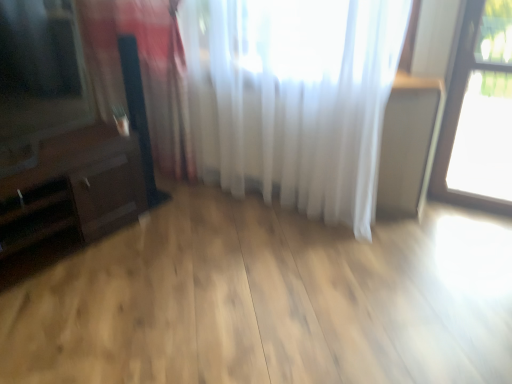
Question: Considering the relative sizes of dark brown wood dresser at left and white sheer curtain at left, the 2th curtain in the right-to-left sequence, in the image provided, is dark brown wood dresser at left shorter than white sheer curtain at left, the 2th curtain in the right-to-left sequence,?

Choices:
 (A) yes
 (B) no

Answer: (A)

Question: Considering the relative sizes of dark brown wood dresser at left and white sheer curtain at left, which is the first curtain in left-to-right order, in the image provided, is dark brown wood dresser at left bigger than white sheer curtain at left, which is the first curtain in left-to-right order,?

Choices:
 (A) yes
 (B) no

Answer: (A)

Question: From a real-world perspective, is dark brown wood dresser at left under white sheer curtain at left, the 2th curtain in the right-to-left sequence?

Choices:
 (A) no
 (B) yes

Answer: (B)

Question: Is dark brown wood dresser at left to the left of white sheer curtain at left, which is the first curtain in left-to-right order, from the viewer's perspective?

Choices:
 (A) yes
 (B) no

Answer: (A)

Question: Is dark brown wood dresser at left outside of white sheer curtain at left, the 2th curtain in the right-to-left sequence?

Choices:
 (A) yes
 (B) no

Answer: (A)

Question: From the image's perspective, is dark brown wood dresser at left located beneath white sheer curtain at left, which is the first curtain in left-to-right order?

Choices:
 (A) yes
 (B) no

Answer: (A)

Question: Does white sheer curtain at left, the 2th curtain in the right-to-left sequence, turn towards transparent glass window at upper right?

Choices:
 (A) no
 (B) yes

Answer: (A)

Question: Does white sheer curtain at left, the 2th curtain in the right-to-left sequence, have a larger size compared to transparent glass window at upper right?

Choices:
 (A) no
 (B) yes

Answer: (B)

Question: From the image's perspective, is white sheer curtain at left, the 2th curtain in the right-to-left sequence, beneath transparent glass window at upper right?

Choices:
 (A) yes
 (B) no

Answer: (A)

Question: Can you confirm if white sheer curtain at left, the 2th curtain in the right-to-left sequence, is smaller than transparent glass window at upper right?

Choices:
 (A) yes
 (B) no

Answer: (B)

Question: Can you confirm if white sheer curtain at left, the 2th curtain in the right-to-left sequence, is shorter than transparent glass window at upper right?

Choices:
 (A) no
 (B) yes

Answer: (B)

Question: Is white sheer curtain at left, the 2th curtain in the right-to-left sequence, not within transparent glass window at upper right?

Choices:
 (A) no
 (B) yes

Answer: (B)

Question: Does white sheer curtain at upper center, the 2th curtain in the left-to-right sequence, have a greater width compared to dark brown wood dresser at left?

Choices:
 (A) no
 (B) yes

Answer: (A)